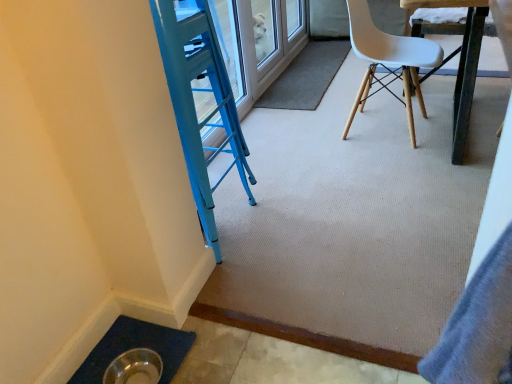
The image size is (512, 384). Identify the location of free location to the left of white plastic chair at upper right. [x=305, y=139].